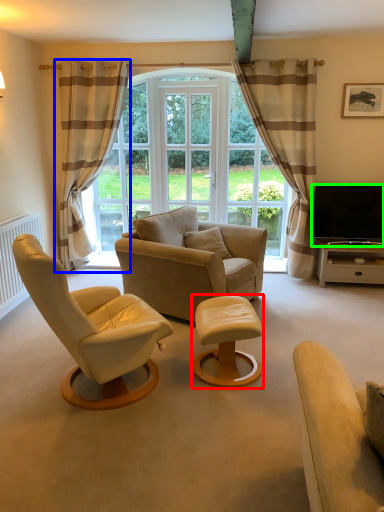
Question: Considering the real-world distances, which object is closest to table (highlighted by a red box)? curtain (highlighted by a blue box) or television (highlighted by a green box).

Choices:
 (A) curtain
 (B) television

Answer: (B)